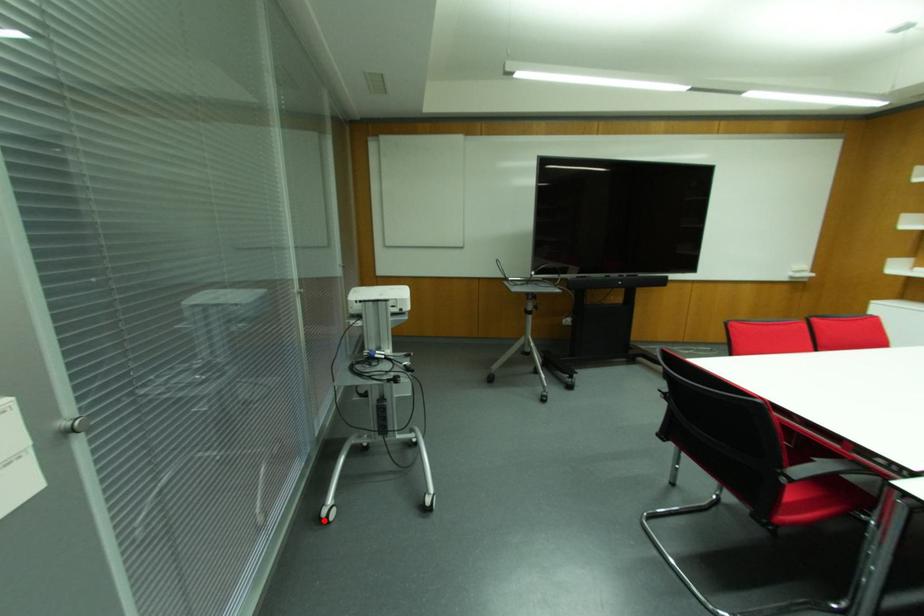
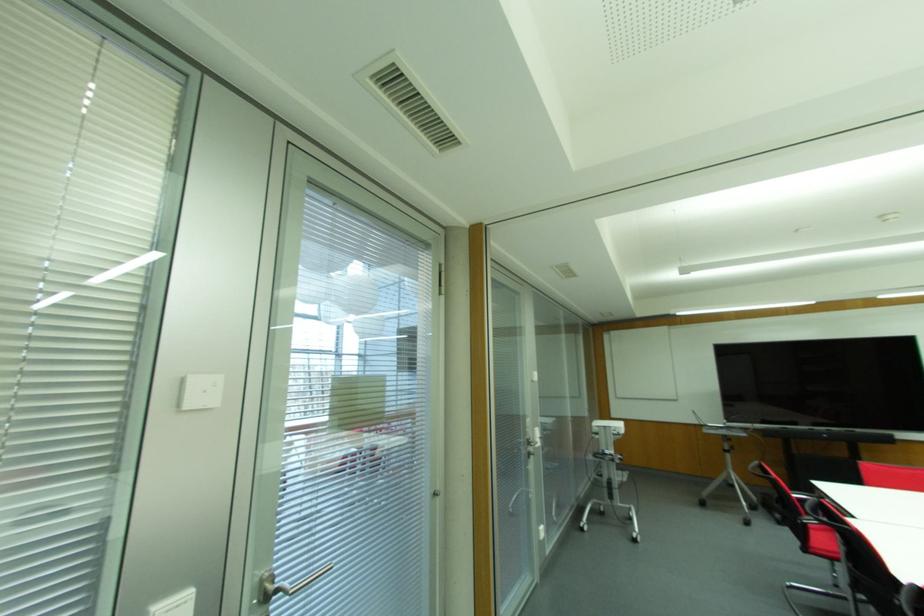
In the second image, find the point that corresponds to the highlighted location in the first image.

(581, 529)